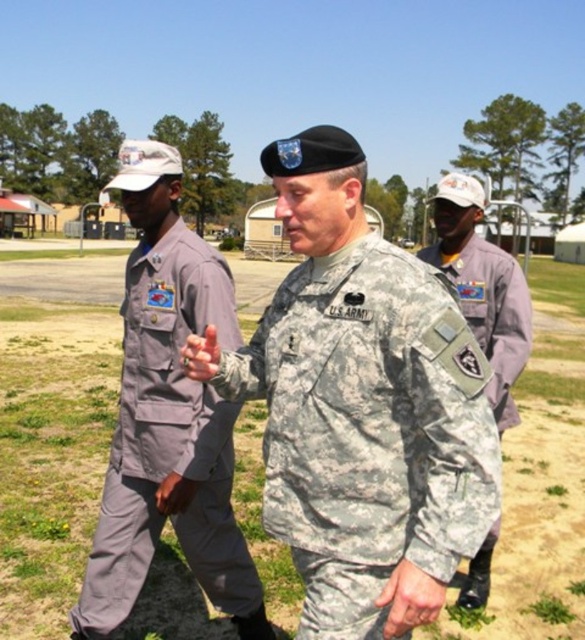
Question: Which of the following is the farthest from the observer?

Choices:
 (A) gray fabric uniform at left
 (B) camouflage fabric us army uniform at center

Answer: (A)

Question: Is camouflage fabric us army uniform at center to the right of camouflage fabric uniform at center from the viewer's perspective?

Choices:
 (A) yes
 (B) no

Answer: (B)

Question: Which point appears closest to the camera in this image?

Choices:
 (A) (225, 275)
 (B) (398, 416)

Answer: (B)

Question: Is gray fabric uniform at left smaller than camouflage fabric uniform at center?

Choices:
 (A) yes
 (B) no

Answer: (A)

Question: Can you confirm if gray fabric uniform at left is positioned to the right of camouflage fabric uniform at center?

Choices:
 (A) no
 (B) yes

Answer: (A)

Question: Estimate the real-world distances between objects in this image. Which object is farther from the gray fabric uniform at left?

Choices:
 (A) camouflage fabric us army uniform at center
 (B) camouflage fabric uniform at center

Answer: (B)